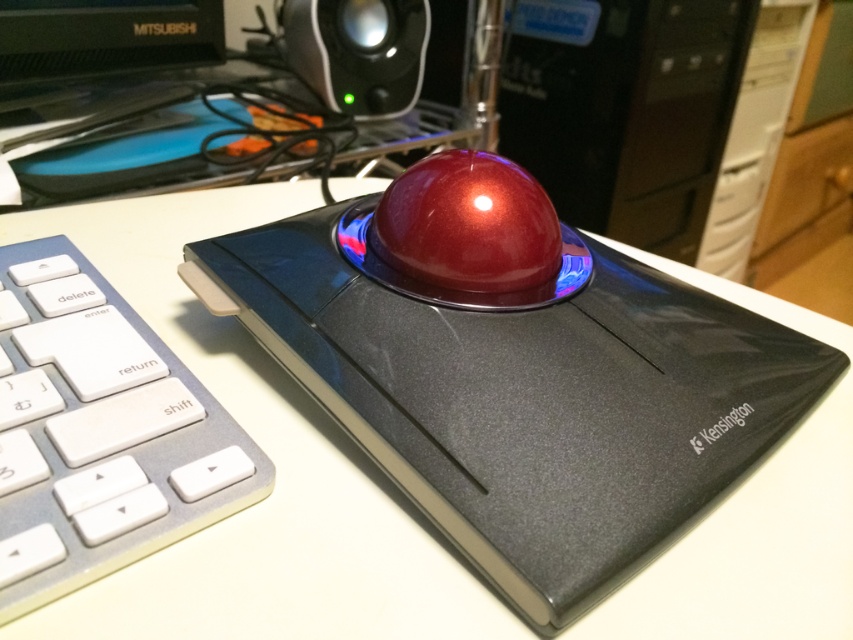
Is metallic red trackball at center closer to camera compared to white plastic keyboard at lower left?

No, it is not.

Which of these two, metallic red trackball at center or white plastic keyboard at lower left, stands shorter?

white plastic keyboard at lower left

Which is in front, point (541, 253) or point (54, 545)?

Positioned in front is point (54, 545).

Locate an element on the screen. metallic red trackball at center is located at coordinates (515, 371).

Does white plastic keyboard at lower left appear on the left side of metallic black speaker at upper center?

Indeed, white plastic keyboard at lower left is positioned on the left side of metallic black speaker at upper center.

Can you confirm if white plastic keyboard at lower left is positioned above metallic black speaker at upper center?

No.

Between point (184, 417) and point (370, 67), which one is positioned behind?

The point (370, 67) is behind.

In order to click on white plastic keyboard at lower left in this screenshot , I will do `click(99, 433)`.

How far apart are metallic red trackball at center and metallic black speaker at upper center?

metallic red trackball at center and metallic black speaker at upper center are 77.09 centimeters apart.

Is point (527, 580) farther from camera compared to point (326, 28)?

No, it is in front of (326, 28).

Which is behind, point (302, 221) or point (363, 70)?

The point (363, 70) is more distant.

In order to click on metallic red trackball at center in this screenshot , I will do `click(515, 371)`.